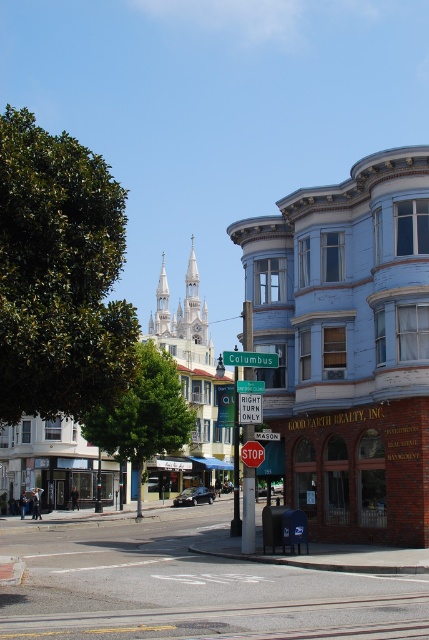
You are a delivery person trying to navigate through the street. The light blue wooden building at center and the smooth asphalt road at center are in your path. Which one do you need to go around because it is taller?

The light blue wooden building at center is much taller than the smooth asphalt road at center, so you need to go around the light blue wooden building at center.

From the picture: You are a delivery person needing to park your van on the smooth asphalt road at center. The van is 2 meters wide. Can you park it between the light blue wooden building at center and the stop sign located at the corner? Please consider the distance between them.

The light blue wooden building at center is to the left of smooth asphalt road at center. Since the building is on the left side of the road and the stop sign is at the corner, the distance between them may vary. However, without specific measurements, it is uncertain if the space is sufficient for a 2m wide van. Check the available space before parking.

Looking at this image, you are a city planner assessing the space between the light blue wooden building at center and the smooth asphalt road at center. If the road is 10 meters wide, what is the minimum width the building must have to ensure it is wider than the road?

The light blue wooden building at center is wider than the smooth asphalt road at center. Since the road is 10 meters wide, the building must be at least 10.1 meters wide to surpass the road.